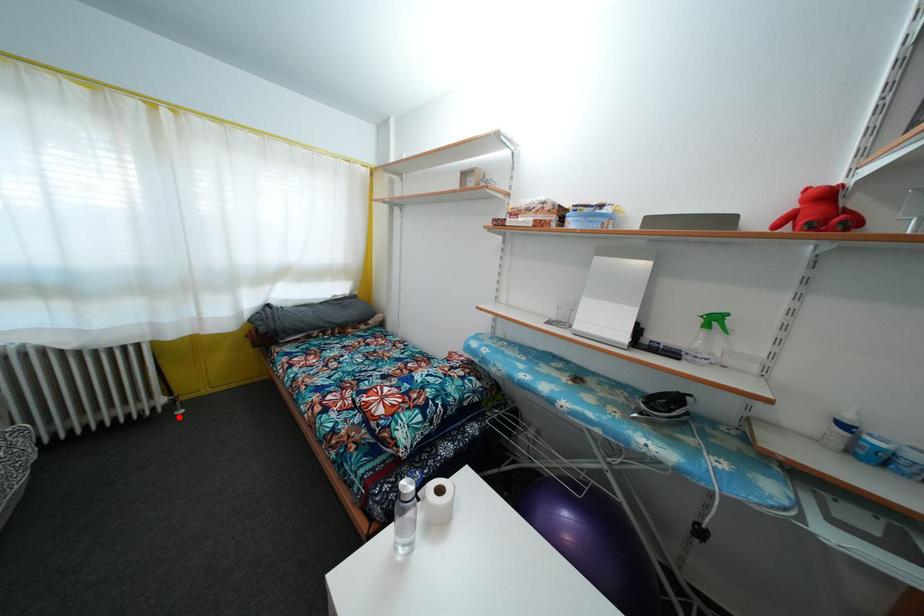
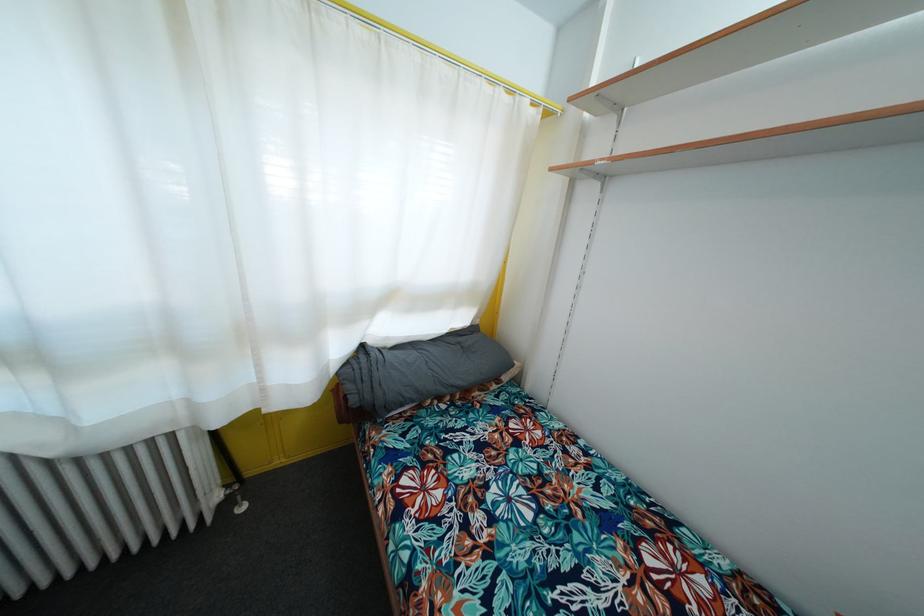
Find the pixel in the second image that matches the highlighted location in the first image.

(240, 511)